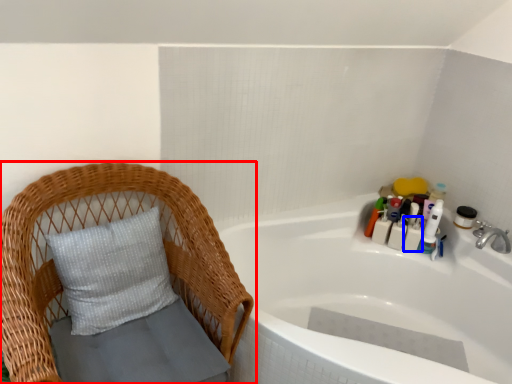
Question: Which object appears farthest to the camera in this image, furniture (highlighted by a red box) or toiletry (highlighted by a blue box)?

Choices:
 (A) furniture
 (B) toiletry

Answer: (B)